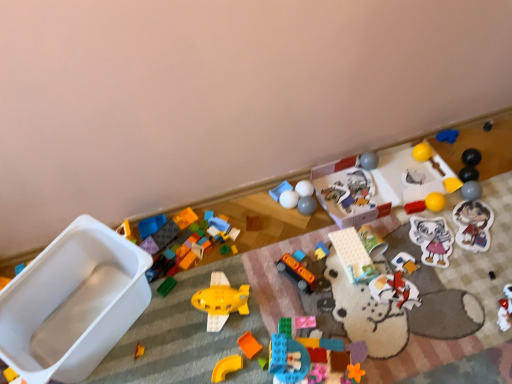
At what (x,y) coordinates should I click in order to perform the action: click on vacant space to the right of yellow plastic airplane at center, the 22th toy in the right-to-left sequence. Please return your answer as a coordinate pair (x, y). Looking at the image, I should click on (277, 299).